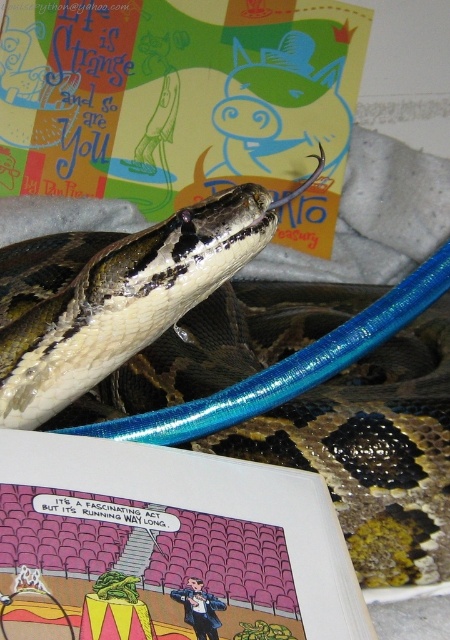
You are a photographer taking a picture of the scene. You notice two points in the image at coordinates point (157, 154) and point (243, 616). Which point is closer to your camera lens?

Point (157, 154) is further to the viewer than point (243, 616). Therefore, point (243, 616) is closer to the camera lens.

You are an assistant organizing books on a shelf. You have two items here, the matte paper comic book at upper center and the comic book paper at upper center. Which one is taller?

The matte paper comic book at upper center is taller than the comic book paper at upper center.

You are a photographer trying to capture a closeup of the shiny brown snake at center and the matte paper comic book at upper center. Since you want both objects to be in focus, which one should you adjust your camera focus closer to?

The shiny brown snake at center is bigger than the matte paper comic book at upper center, so you should adjust your camera focus closer to the matte paper comic book at upper center to ensure both are in focus.